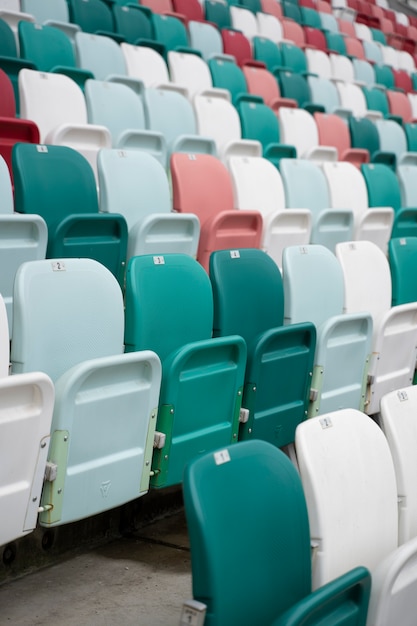
You are a GUI agent. You are given a task and a screenshot of the screen. Output one action in this format:
    pyautogui.click(x=<x>, y=<y>)
    Task: Click on the rows of seats
    This screenshot has height=626, width=417.
    Given the screenshot: What is the action you would take?
    pyautogui.click(x=254, y=573), pyautogui.click(x=103, y=403), pyautogui.click(x=56, y=198), pyautogui.click(x=41, y=100), pyautogui.click(x=118, y=63), pyautogui.click(x=128, y=18), pyautogui.click(x=186, y=7), pyautogui.click(x=271, y=4), pyautogui.click(x=320, y=4), pyautogui.click(x=366, y=3)